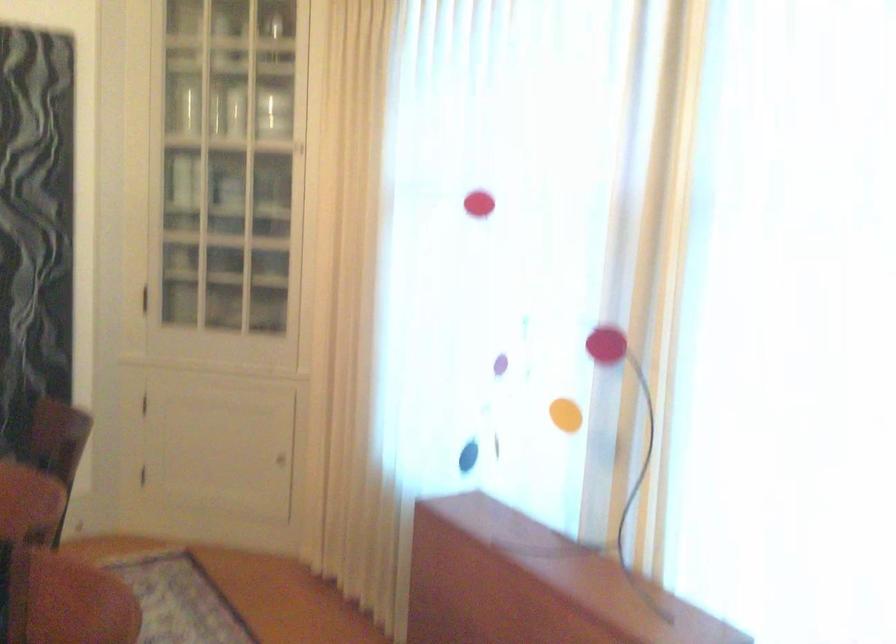
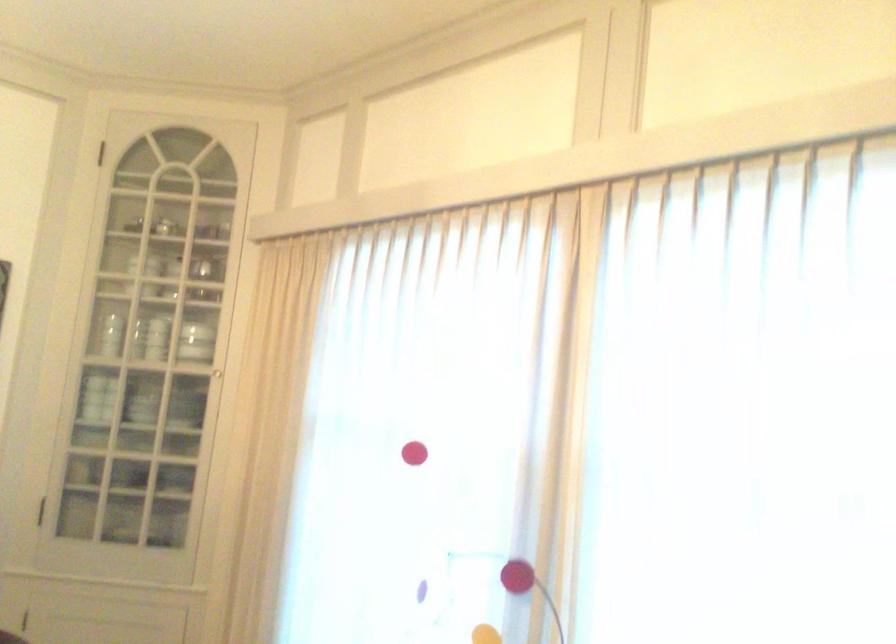
Question: The images are taken continuously from a first-person perspective. In which direction is your viewpoint rotating?

Choices:
 (A) Left
 (B) Right
 (C) Up
 (D) Down

Answer: (C)